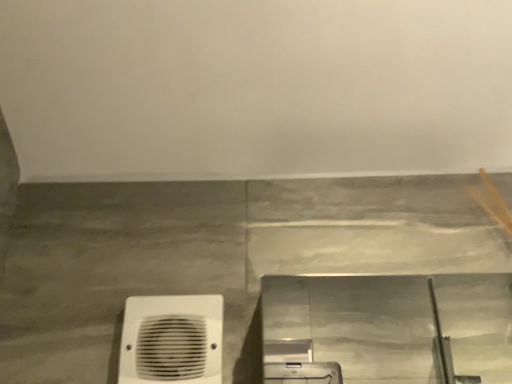
What is the approximate width of white plastic speaker at lower left?

It is 1.66 inches.

Locate an element on the screen. The image size is (512, 384). white plastic speaker at lower left is located at coordinates (172, 339).

What do you see at coordinates (172, 339) in the screenshot? I see `white plastic speaker at lower left` at bounding box center [172, 339].

Locate an element on the screen. This screenshot has width=512, height=384. white plastic speaker at lower left is located at coordinates (172, 339).